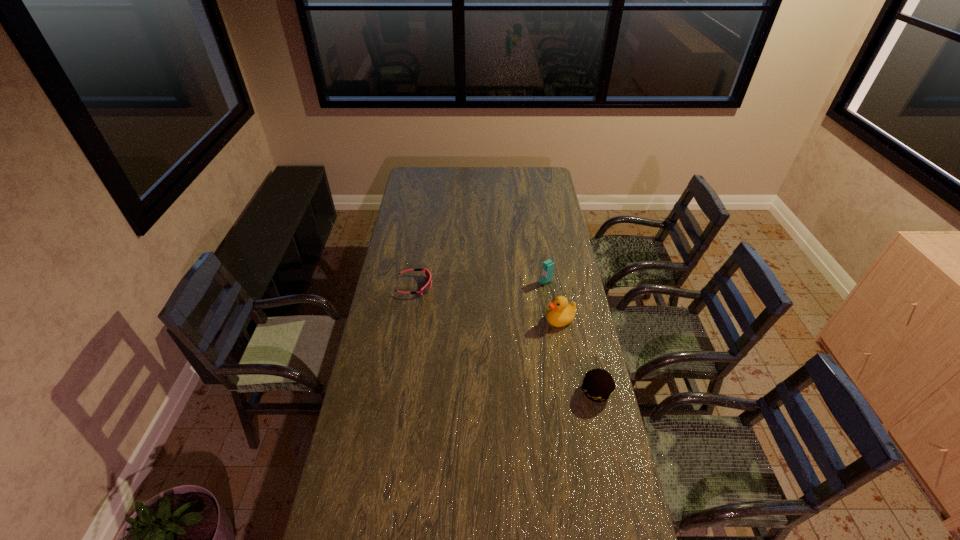
The width and height of the screenshot is (960, 540). In order to click on free point between the tallest object and the leftmost object in this screenshot , I will do `click(480, 284)`.

Locate an element on the screen. This screenshot has height=540, width=960. vacant area that lies between the goggles and the nearest object is located at coordinates (505, 339).

Locate an element on the screen. This screenshot has width=960, height=540. object that is the second nearest to the leftmost object is located at coordinates (560, 313).

Locate which object is the closest to the second shortest object. Please provide its 2D coordinates. Your answer should be formatted as a tuple, i.e. [(x, y)], where the tuple contains the x and y coordinates of a point satisfying the conditions above.

[(560, 313)]